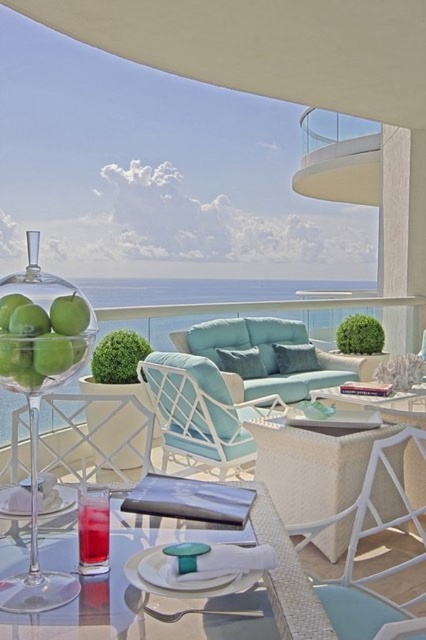
Question: Observing the image, what is the correct spatial positioning of white wicker table at center in reference to clear glass table at center?

Choices:
 (A) below
 (B) above

Answer: (A)

Question: Does white wicker table at center come behind white glass railing at upper right?

Choices:
 (A) yes
 (B) no

Answer: (B)

Question: Among these points, which one is nearest to the camera?

Choices:
 (A) (328, 156)
 (B) (161, 416)

Answer: (B)

Question: Considering the relative positions of teal fabric couch at center and white glass railing at upper right in the image provided, where is teal fabric couch at center located with respect to white glass railing at upper right?

Choices:
 (A) below
 (B) above

Answer: (A)

Question: Estimate the real-world distances between objects in this image. Which object is closer to the white wicker table at center?

Choices:
 (A) white glass railing at upper right
 (B) clear glass table at center

Answer: (B)

Question: Which is nearer to the white wicker table at center?

Choices:
 (A) clear glass table at center
 (B) teal fabric couch at center
 (C) transparent glass bowl at center
 (D) white glass railing at upper right

Answer: (A)